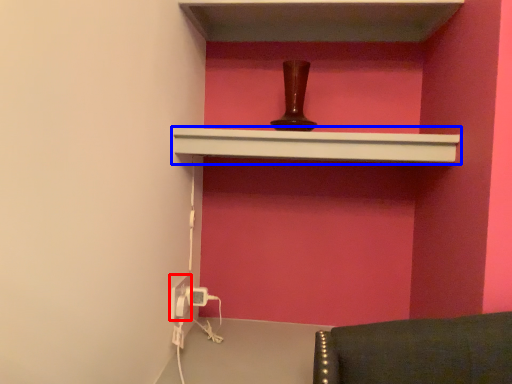
Question: Among these objects, which one is nearest to the camera, electric outlet (highlighted by a red box) or shelf (highlighted by a blue box)?

Choices:
 (A) electric outlet
 (B) shelf

Answer: (B)